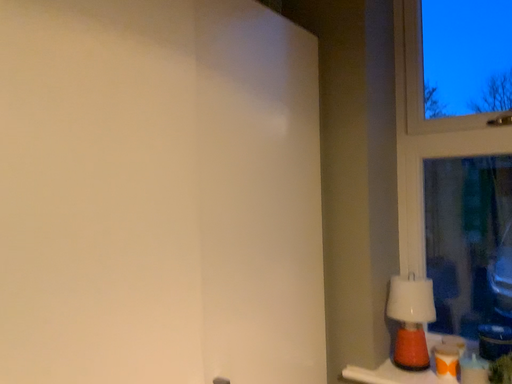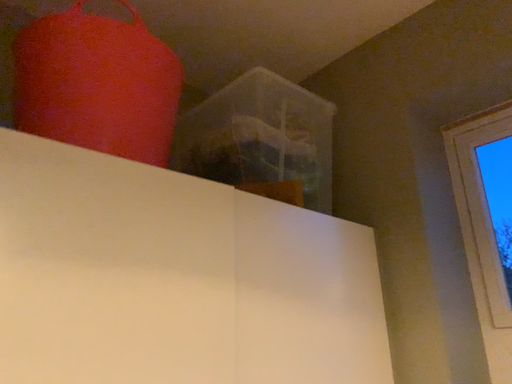
Question: How did the camera likely rotate when shooting the video?

Choices:
 (A) rotated downward
 (B) rotated upward

Answer: (B)